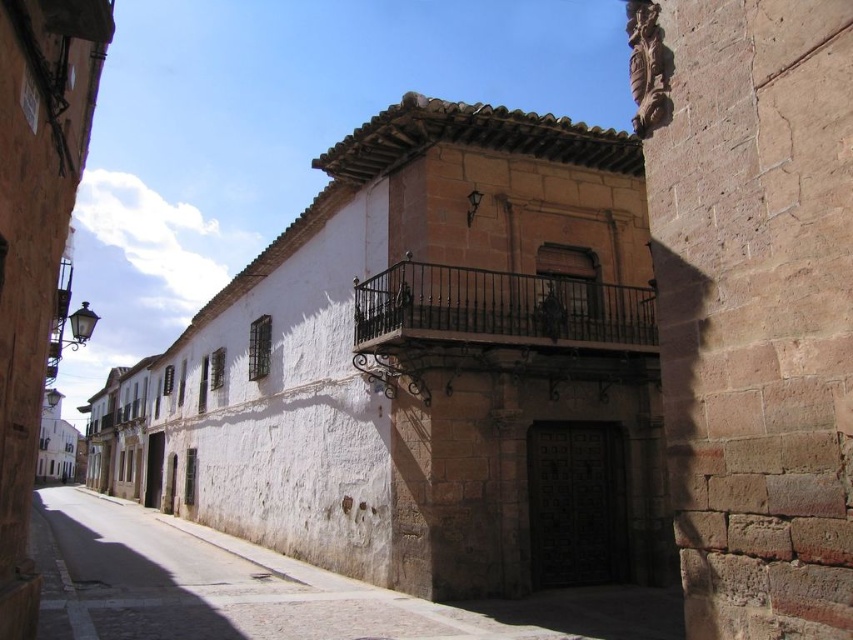
Question: Is white stone wall at lower center to the left of black wrought iron balcony at center from the viewer's perspective?

Choices:
 (A) yes
 (B) no

Answer: (A)

Question: Which of the following is the closest to the observer?

Choices:
 (A) (158, 611)
 (B) (381, 339)

Answer: (A)

Question: Does white stone wall at lower center have a greater width compared to black wrought iron balcony at center?

Choices:
 (A) yes
 (B) no

Answer: (A)

Question: Which of the following is the farthest from the observer?

Choices:
 (A) white stone wall at lower center
 (B) black wrought iron balcony at center

Answer: (B)

Question: Which of the following is the farthest from the observer?

Choices:
 (A) white stone wall at lower center
 (B) black wrought iron balcony at center

Answer: (B)

Question: Where is white stone wall at lower center located in relation to black wrought iron balcony at center in the image?

Choices:
 (A) below
 (B) above

Answer: (A)